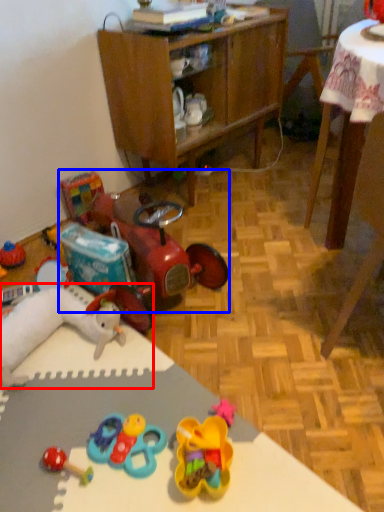
Question: Which object appears farthest to the camera in this image, toy (highlighted by a red box) or toy (highlighted by a blue box)?

Choices:
 (A) toy
 (B) toy

Answer: (B)